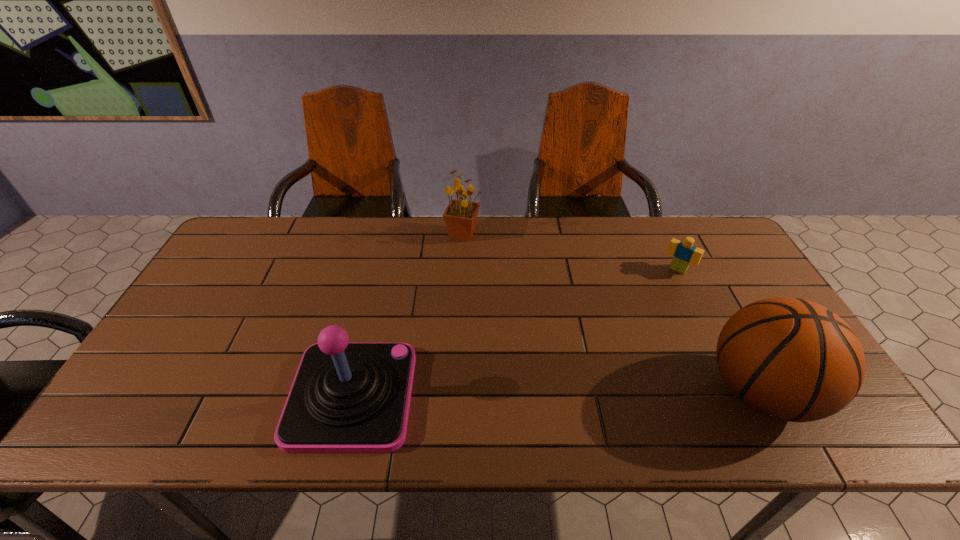
I want to click on vacant spot on the desktop that is between the leftmost object and the basketball and is positioned at the front of the third object from right to left with flowers visible, so click(x=608, y=393).

Image resolution: width=960 pixels, height=540 pixels. I want to click on free space on the desktop that is between the joystick and the basketball and is positioned on the face of the shortest object, so click(x=589, y=393).